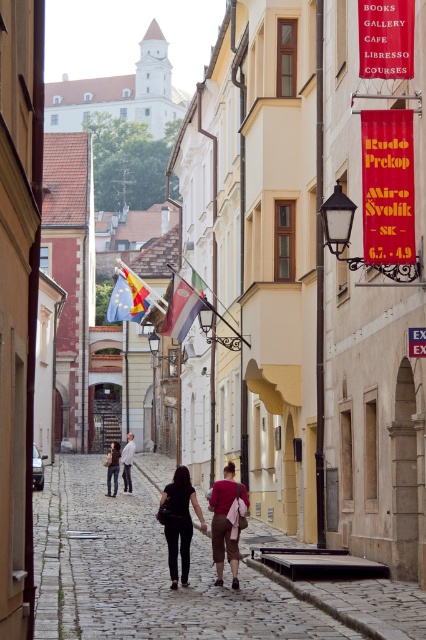
Is polished wood flag at center shorter than dark brown leather jacket at center?

Yes, polished wood flag at center is shorter than dark brown leather jacket at center.

Between polished wood flag at center and dark brown leather jacket at center, which one is positioned higher?

polished wood flag at center is higher up.

Find the location of `polished wood flag at center`. polished wood flag at center is located at coordinates click(181, 308).

Does cobblestone alley at center have a lesser height compared to dark brown leather jacket at center?

Yes.

Is cobblestone alley at center above dark brown leather jacket at center?

Yes.

Measure the distance between cobblestone alley at center and camera.

cobblestone alley at center and camera are 21.12 meters apart.

Find the location of `cobblestone alley at center`. cobblestone alley at center is located at coordinates (158, 576).

Who is more distant from viewer, (183,564) or (114,468)?

Point (114,468)

Does point (161, 497) lie behind point (129, 445)?

No, it is not.

Does point (186, 586) come in front of point (132, 456)?

Yes, it is.

Where is `dark brown leather pants at center`? dark brown leather pants at center is located at coordinates (180, 522).